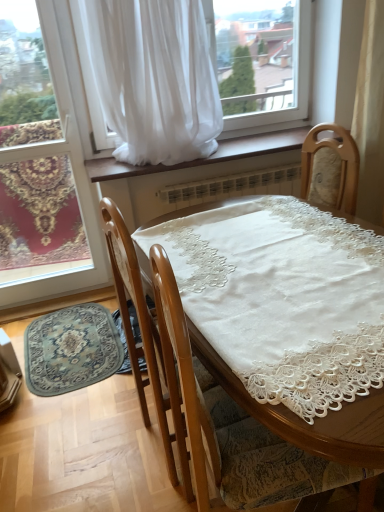
Question: From the image's perspective, is white sheer curtain at upper center on top of brown wood at center?

Choices:
 (A) yes
 (B) no

Answer: (A)

Question: From the image's perspective, would you say white sheer curtain at upper center is shown under brown wood at center?

Choices:
 (A) no
 (B) yes

Answer: (A)

Question: Does white sheer curtain at upper center turn towards brown wood at center?

Choices:
 (A) no
 (B) yes

Answer: (A)

Question: Can you confirm if white sheer curtain at upper center is taller than brown wood at center?

Choices:
 (A) no
 (B) yes

Answer: (B)

Question: Does white sheer curtain at upper center lie in front of brown wood at center?

Choices:
 (A) yes
 (B) no

Answer: (A)

Question: Looking at their shapes, would you say white sheer curtain at upper center is wider or thinner than wooden chair at center?

Choices:
 (A) wide
 (B) thin

Answer: (B)

Question: Visually, is white sheer curtain at upper center positioned to the left or to the right of wooden chair at center?

Choices:
 (A) right
 (B) left

Answer: (B)

Question: From the image's perspective, relative to wooden chair at center, is white sheer curtain at upper center above or below?

Choices:
 (A) below
 (B) above

Answer: (B)

Question: Is white sheer curtain at upper center bigger or smaller than wooden chair at center?

Choices:
 (A) small
 (B) big

Answer: (A)

Question: Considering the positions of white sheer curtain at upper center and blue patterned rug at lower left in the image, is white sheer curtain at upper center wider or thinner than blue patterned rug at lower left?

Choices:
 (A) wide
 (B) thin

Answer: (B)

Question: Relative to blue patterned rug at lower left, is white sheer curtain at upper center in front or behind?

Choices:
 (A) behind
 (B) front

Answer: (B)

Question: From a real-world perspective, relative to blue patterned rug at lower left, is white sheer curtain at upper center vertically above or below?

Choices:
 (A) above
 (B) below

Answer: (A)

Question: From the image's perspective, is white sheer curtain at upper center above or below blue patterned rug at lower left?

Choices:
 (A) below
 (B) above

Answer: (B)

Question: Looking at their shapes, would you say matte glass window at lower left is wider or thinner than wooden chair at center?

Choices:
 (A) wide
 (B) thin

Answer: (B)

Question: Does point (38, 295) appear closer or farther from the camera than point (231, 498)?

Choices:
 (A) closer
 (B) farther

Answer: (B)